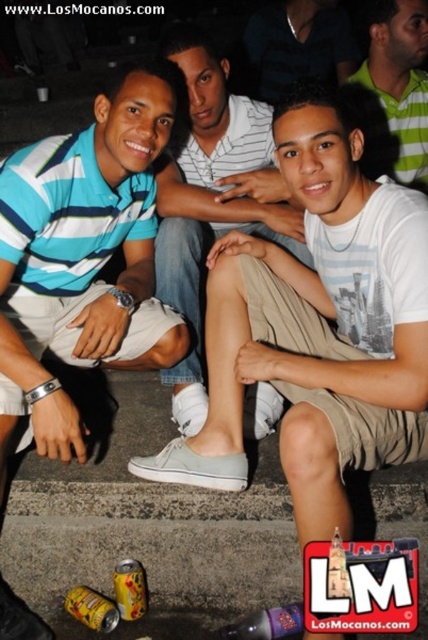
Is white canvas shoe at lower left bigger than light brown fabric pants at center?

Correct, white canvas shoe at lower left is larger in size than light brown fabric pants at center.

Find the location of a particular element. This screenshot has width=428, height=640. white canvas shoe at lower left is located at coordinates (317, 326).

Find the location of a particular element. The image size is (428, 640). white canvas shoe at lower left is located at coordinates pos(317,326).

Which of these two, white canvas shoe at lower left or blue striped polo shirt at left, stands shorter?

Standing shorter between the two is white canvas shoe at lower left.

Is point (425, 202) more distant than point (14, 241)?

No, it is not.

The image size is (428, 640). In order to click on white canvas shoe at lower left in this screenshot , I will do [x=317, y=326].

Does point (136, 189) come closer to viewer compared to point (217, 180)?

Yes, point (136, 189) is closer to viewer.

Is point (62, 186) farther from camera compared to point (222, 163)?

No, (62, 186) is in front of (222, 163).

Does point (140, 291) come in front of point (269, 406)?

No, it is not.

The height and width of the screenshot is (640, 428). Find the location of `blue striped polo shirt at left`. blue striped polo shirt at left is located at coordinates (83, 259).